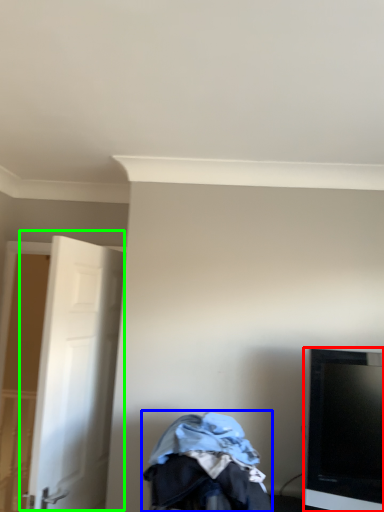
Question: Which object is the closest to the television (highlighted by a red box)? Choose among these: baby carriage (highlighted by a blue box) or door (highlighted by a green box).

Choices:
 (A) baby carriage
 (B) door

Answer: (A)